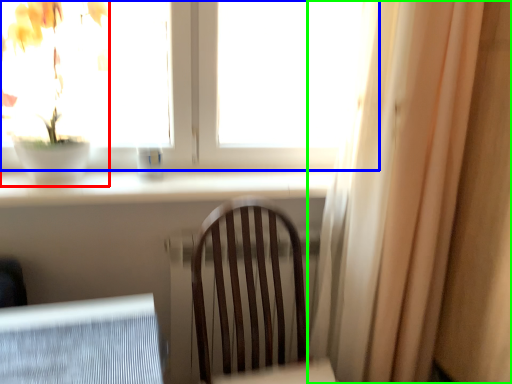
Question: Estimate the real-world distances between objects in this image. Which object is closer to houseplant (highlighted by a red box), window (highlighted by a blue box) or curtain (highlighted by a green box)?

Choices:
 (A) window
 (B) curtain

Answer: (A)